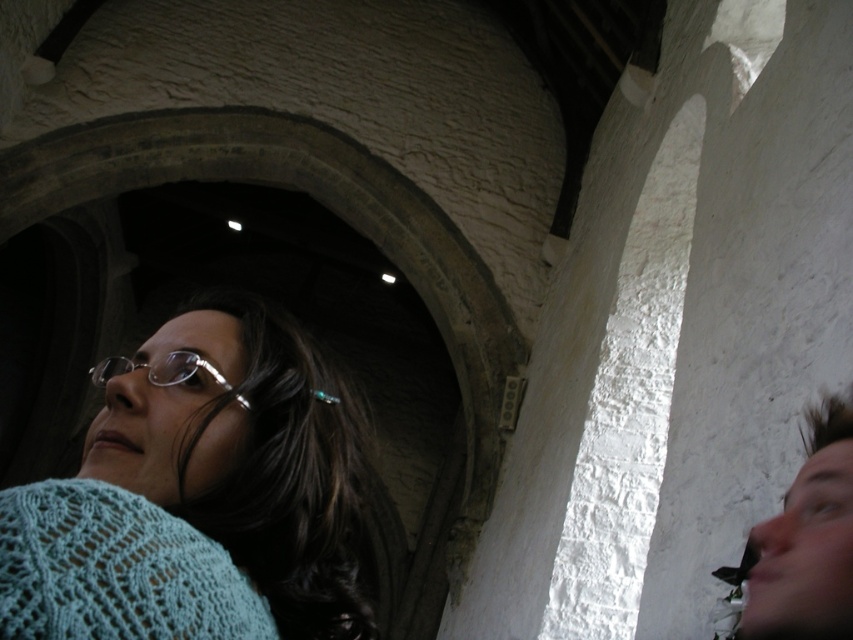
Question: Which point is farther from the camera taking this photo?

Choices:
 (A) (152, 372)
 (B) (830, 548)
 (C) (20, 506)

Answer: (A)

Question: Is knitted light blue sweater at lower left smaller than silver metallic glasses at center?

Choices:
 (A) no
 (B) yes

Answer: (B)

Question: Can you confirm if knitted light blue sweater at lower left is thinner than smooth brown hair at right?

Choices:
 (A) yes
 (B) no

Answer: (A)

Question: Is knitted light blue sweater at lower left above smooth brown hair at right?

Choices:
 (A) no
 (B) yes

Answer: (B)

Question: Based on their relative distances, which object is farther from the silver metallic glasses at center?

Choices:
 (A) knitted light blue sweater at lower left
 (B) smooth brown hair at right

Answer: (B)

Question: Among these objects, which one is farthest from the camera?

Choices:
 (A) smooth brown hair at right
 (B) knitted light blue sweater at lower left

Answer: (B)